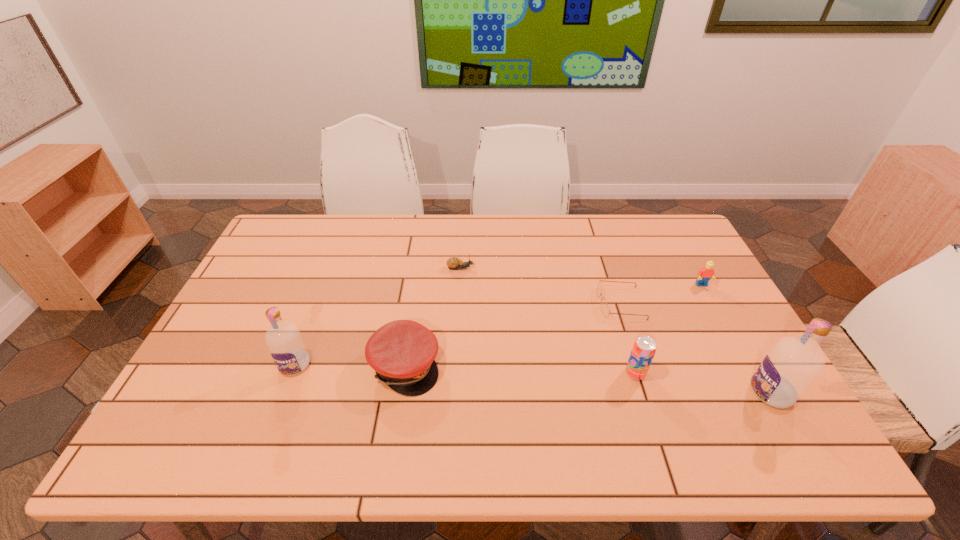
The width and height of the screenshot is (960, 540). Find the location of `vacant area situated 0.310m on the label of the taller vodka`. vacant area situated 0.310m on the label of the taller vodka is located at coordinates (625, 393).

Identify the location of free space located on the label of the taller vodka. (605, 393).

Image resolution: width=960 pixels, height=540 pixels. I want to click on free space located on the label of the taller vodka, so click(588, 393).

Find the location of a particular element. The image size is (960, 540). free point located 0.370m on the face of the Lego is located at coordinates [x=759, y=391].

Locate an element on the screen. This screenshot has width=960, height=540. vacant space located on the front-facing side of the escargot is located at coordinates (580, 268).

Locate an element on the screen. The width and height of the screenshot is (960, 540). free space located 0.210m on the front-facing side of the spectacles is located at coordinates pos(528,303).

Where is `free space located 0.340m on the front-facing side of the spectacles`? The width and height of the screenshot is (960, 540). free space located 0.340m on the front-facing side of the spectacles is located at coordinates (485, 303).

Where is `vacant space located on the front-facing side of the spectacles`? The image size is (960, 540). vacant space located on the front-facing side of the spectacles is located at coordinates (565, 303).

The image size is (960, 540). I want to click on free space located 0.250m on the front-facing side of the cap, so click(x=536, y=366).

At what (x,y) coordinates should I click in order to perform the action: click on vacant area located on the front of the fifth shortest object. Please return your answer as a coordinate pair (x, y). Image resolution: width=960 pixels, height=540 pixels. Looking at the image, I should click on (649, 417).